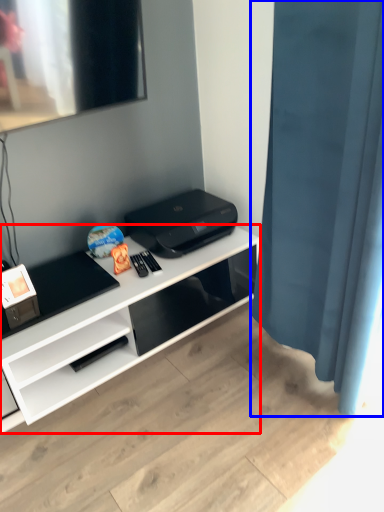
Question: Which point is further to the camera, desk (highlighted by a red box) or shower curtain (highlighted by a blue box)?

Choices:
 (A) desk
 (B) shower curtain

Answer: (A)